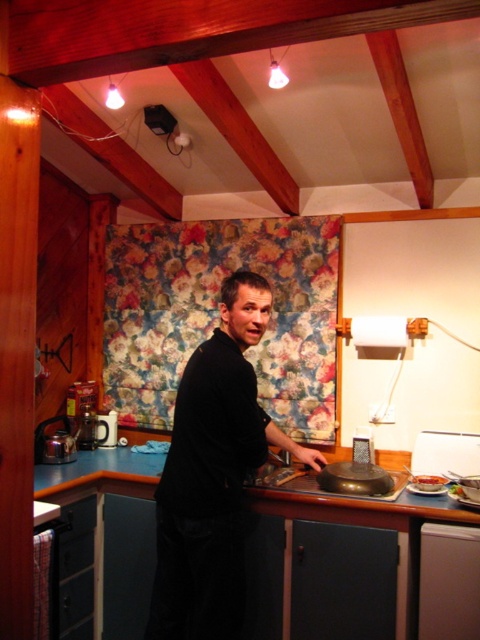
You are preparing to place the slightly browned bread at lower right onto the white glossy plate at lower right. Based on their sizes, will the bread fit entirely on the plate?

The slightly browned bread at lower right is larger than the white glossy plate at lower right, so it will not fit entirely on the plate.

Based on the photo, you are a photographer standing 1.5 meters away from the camera. You want to take a photo of the black matte shirt at center. Can you reach the camera to adjust it without moving your position?

The distance between you and the camera is 1.5 meters, and the camera and the black matte shirt at center are 1.91 meters apart. Since you can only reach the camera if it is within your arm length, but the exact arm length isn not provided, so it is uncertain whether you can adjust the camera without moving.

You are a chef in this kitchen and need to place a new ingredient exactly at coordinate point 0.8, 0.9. Is the slightly browned bread at lower right already occupying that spot?

The slightly browned bread at lower right is located at point (428, 483), which is close to but not exactly at (432, 512). Therefore, the spot is available for placing the new ingredient.